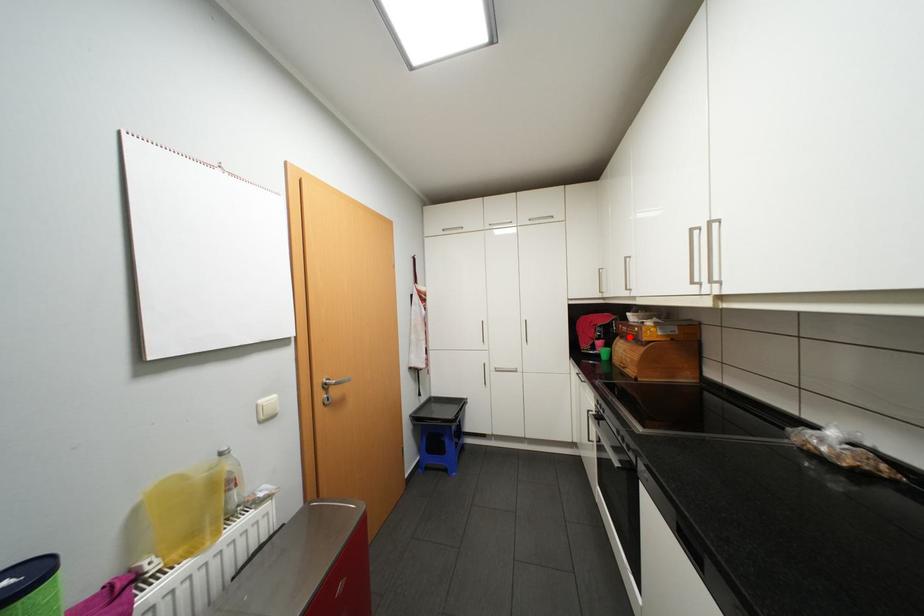
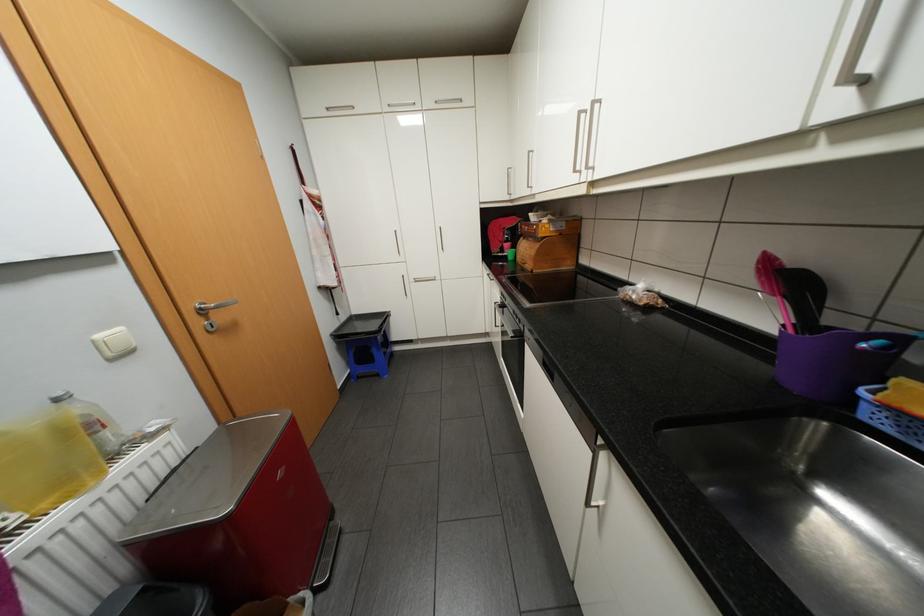
The point at the highlighted location is marked in the first image. Where is the corresponding point in the second image?

(531, 237)